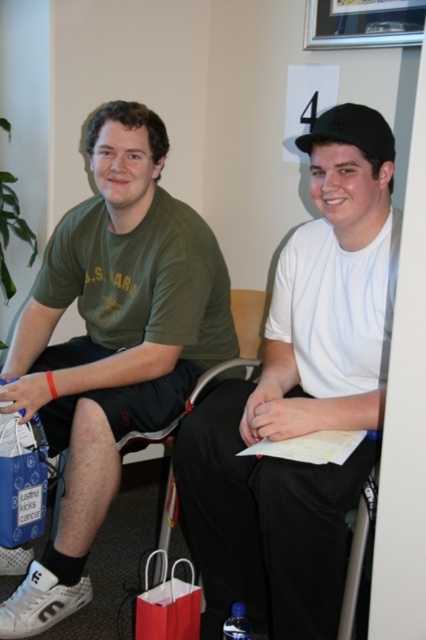
You are a photographer setting up a camera at eye level. You want to capture both the white matte shirt at center and the blue fabric shopping bag at lower left in your shot. Which object will appear higher in the photo?

The white matte shirt at center will appear higher in the photo because it is positioned above the blue fabric shopping bag at lower left.

You are a delivery robot with a 24 inch wide package. You need to place it between the white matte shirt at center and the blue fabric shopping bag at lower left. Is there enough space?

The distance between the white matte shirt at center and the blue fabric shopping bag at lower left is 26.12 inches, which is wider than the 24 inch package. There is enough space to place the package between them.

You are standing in the waiting area and want to move from point [16,540] to point [150,636]. Which direction should you move to get closer to your destination?

Since point [16,540] is closer to you than point [150,636], you should move forward to get closer to your destination.